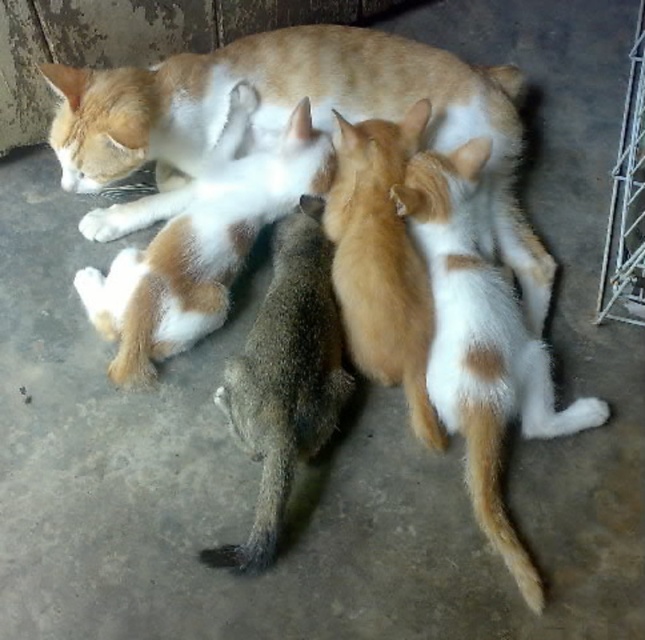
Question: Which object is farther from the camera taking this photo?

Choices:
 (A) orange-white fur cat at center
 (B) orange and white fur cat at upper left
 (C) fluffy orange kitten at center
 (D) metallic silver cage at right

Answer: (D)

Question: Which object is farther from the camera taking this photo?

Choices:
 (A) orange and white fur cat at upper left
 (B) orange-white fur cat at center
 (C) metallic silver cage at right
 (D) fluffy orange kitten at center

Answer: (C)

Question: Which of these objects is positioned closest to the metallic silver cage at right?

Choices:
 (A) orange-white fur cat at center
 (B) orange and white fur cat at upper left
 (C) fluffy orange kitten at center

Answer: (A)

Question: Can you confirm if orange-white fur cat at center is wider than fluffy orange kitten at center?

Choices:
 (A) yes
 (B) no

Answer: (A)

Question: Is fluffy orange kitten at center to the right of metallic silver cage at right from the viewer's perspective?

Choices:
 (A) yes
 (B) no

Answer: (B)

Question: Is the position of orange-white fur cat at center less distant than that of fluffy orange kitten at center?

Choices:
 (A) no
 (B) yes

Answer: (B)